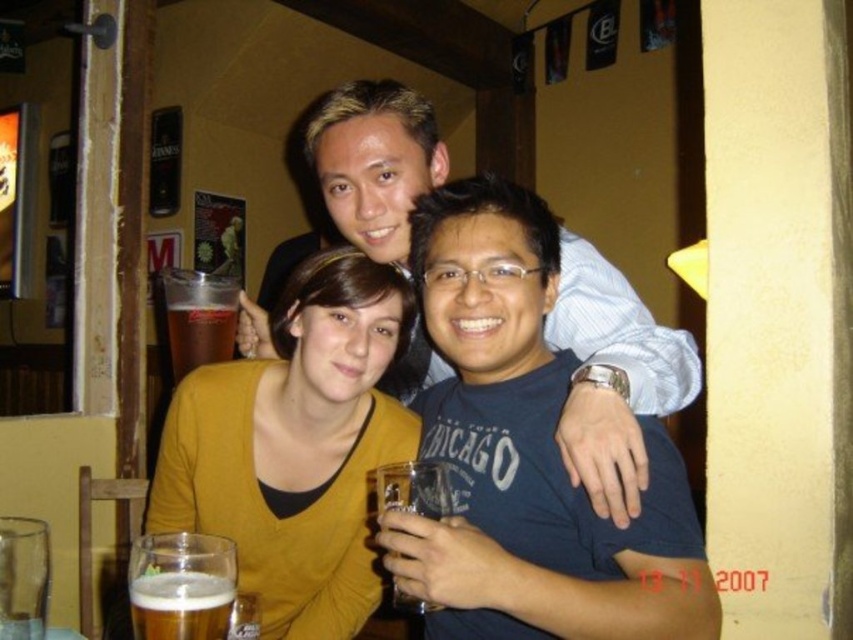
Does blue cotton t-shirt at center lie behind clear glass beer at center?

That is False.

Does blue cotton t-shirt at center have a lesser width compared to clear glass beer at center?

Incorrect, blue cotton t-shirt at center's width is not less than clear glass beer at center's.

Between point (654, 484) and point (397, 476), which one is positioned behind?

The point (654, 484) is behind.

Locate an element on the screen. blue cotton t-shirt at center is located at coordinates (527, 454).

Who is positioned more to the right, translucent glass beer at lower left or translucent plastic cup at center?

translucent glass beer at lower left is more to the right.

Is the position of translucent glass beer at lower left less distant than that of translucent plastic cup at center?

Yes.

Who is more distant from viewer, (222, 609) or (177, 355)?

Positioned behind is point (177, 355).

Where is `translucent glass beer at lower left`? The width and height of the screenshot is (853, 640). translucent glass beer at lower left is located at coordinates (181, 586).

Can you confirm if matte black shirt at center is positioned to the left of clear glass beer at center?

No, matte black shirt at center is not to the left of clear glass beer at center.

The width and height of the screenshot is (853, 640). I want to click on matte black shirt at center, so click(613, 378).